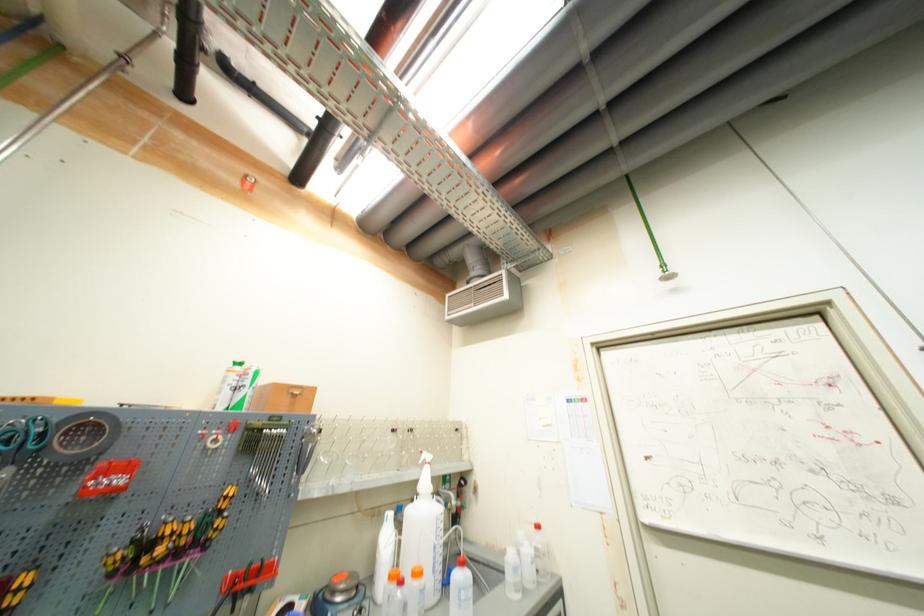
Where is `orange bottle cap`? The width and height of the screenshot is (924, 616). orange bottle cap is located at coordinates (338, 577).